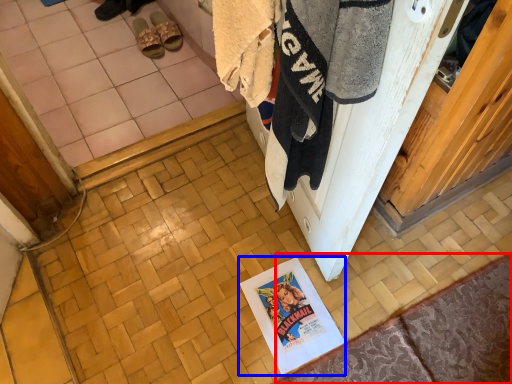
Question: Which of the following is the closest to the observer, doormat (highlighted by a red box) or poster page (highlighted by a blue box)?

Choices:
 (A) doormat
 (B) poster page

Answer: (A)